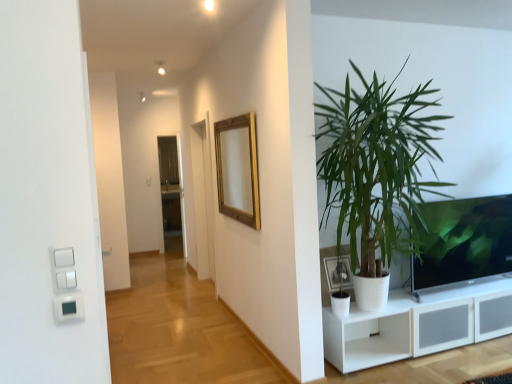
Question: Is transparent glass door at center smaller than matte black tv at right?

Choices:
 (A) yes
 (B) no

Answer: (A)

Question: Is transparent glass door at center positioned behind matte black tv at right?

Choices:
 (A) yes
 (B) no

Answer: (A)

Question: Is transparent glass door at center facing away from matte black tv at right?

Choices:
 (A) no
 (B) yes

Answer: (A)

Question: Does transparent glass door at center come in front of matte black tv at right?

Choices:
 (A) no
 (B) yes

Answer: (A)

Question: Can you confirm if transparent glass door at center is taller than matte black tv at right?

Choices:
 (A) no
 (B) yes

Answer: (B)

Question: Is matte black tv at right a part of transparent glass door at center?

Choices:
 (A) yes
 (B) no

Answer: (B)

Question: Is white plastic light switch at lower left next to transparent glass door at center and touching it?

Choices:
 (A) yes
 (B) no

Answer: (B)

Question: Is white plastic light switch at lower left surrounding transparent glass door at center?

Choices:
 (A) no
 (B) yes

Answer: (A)

Question: Considering the relative sizes of white plastic light switch at lower left and transparent glass door at center in the image provided, is white plastic light switch at lower left shorter than transparent glass door at center?

Choices:
 (A) no
 (B) yes

Answer: (B)

Question: Does white plastic light switch at lower left appear on the right side of transparent glass door at center?

Choices:
 (A) no
 (B) yes

Answer: (B)

Question: Does white plastic light switch at lower left have a lesser width compared to transparent glass door at center?

Choices:
 (A) yes
 (B) no

Answer: (A)

Question: From a real-world perspective, is white plastic light switch at lower left physically below transparent glass door at center?

Choices:
 (A) yes
 (B) no

Answer: (B)

Question: From the image's perspective, is gold wooden mirror at upper center on top of matte black tv at right?

Choices:
 (A) no
 (B) yes

Answer: (B)